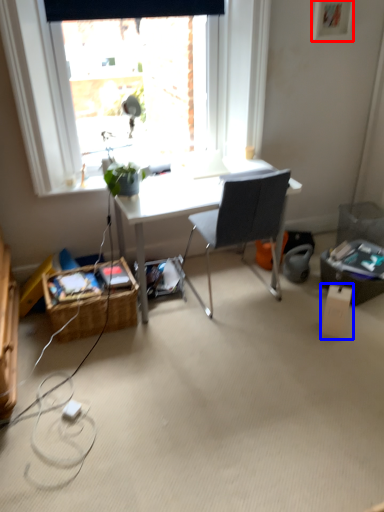
Question: Among these objects, which one is nearest to the camera, picture frame (highlighted by a red box) or box (highlighted by a blue box)?

Choices:
 (A) picture frame
 (B) box

Answer: (B)